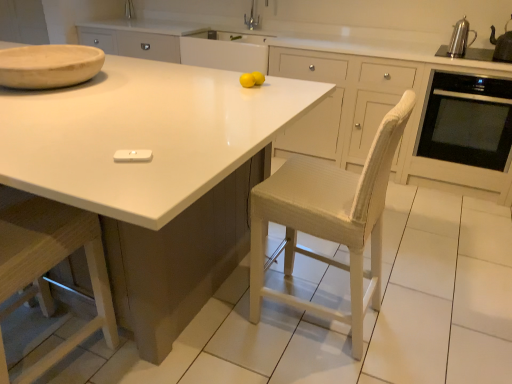
Image resolution: width=512 pixels, height=384 pixels. Identify the location of free space above white matte sink at center (from a real-world perspective). (233, 38).